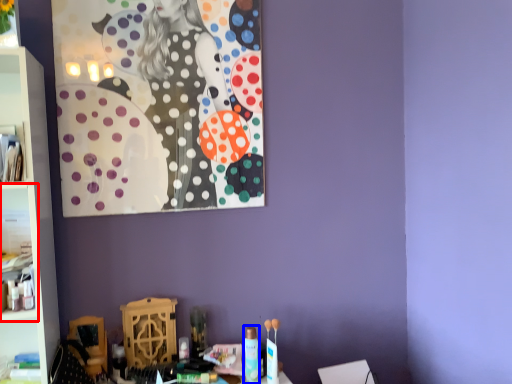
Question: Which object is further to the camera taking this photo, cabinet (highlighted by a red box) or toiletry (highlighted by a blue box)?

Choices:
 (A) cabinet
 (B) toiletry

Answer: (B)